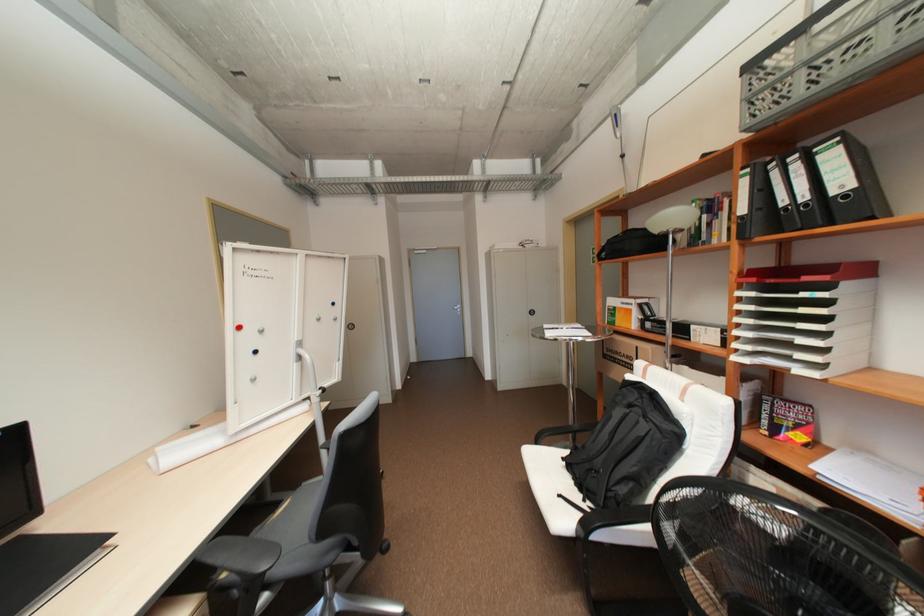
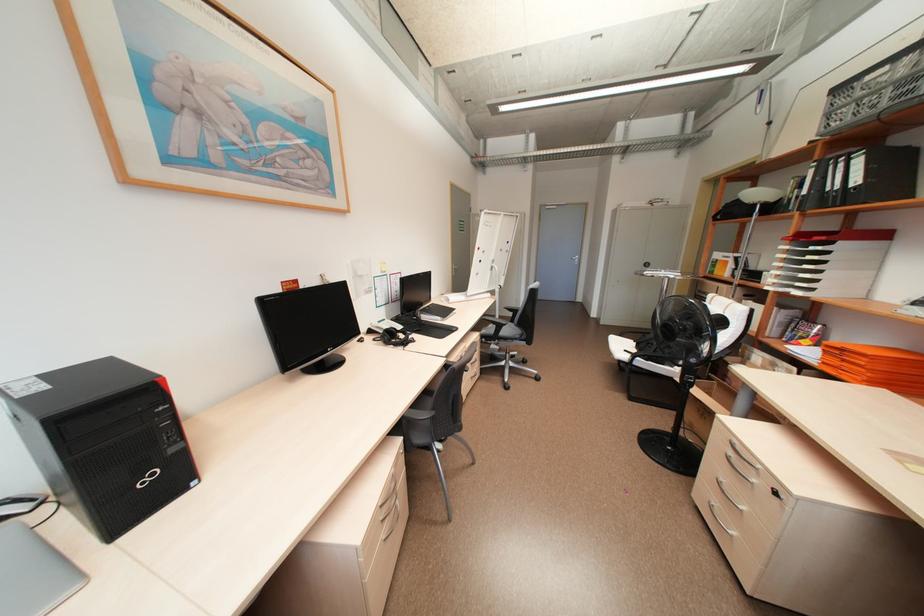
In the second image, find the point that corresponds to (x=748, y=209) in the first image.

(810, 191)